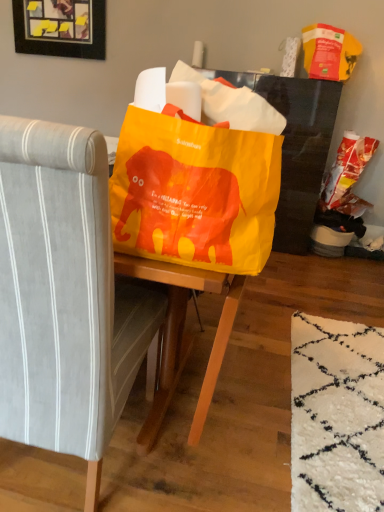
Question: Is wooden frame with yellow sticky notes at upper left in front of yellow plastic grocery bag at upper right, acting as the 2th grocery bag starting from the bottom?

Choices:
 (A) no
 (B) yes

Answer: (A)

Question: Is wooden frame with yellow sticky notes at upper left positioned beyond the bounds of yellow plastic grocery bag at upper right, arranged as the first grocery bag when viewed from the top?

Choices:
 (A) yes
 (B) no

Answer: (A)

Question: Considering the relative sizes of wooden frame with yellow sticky notes at upper left and yellow plastic grocery bag at upper right, arranged as the first grocery bag when viewed from the top, in the image provided, is wooden frame with yellow sticky notes at upper left shorter than yellow plastic grocery bag at upper right, arranged as the first grocery bag when viewed from the top,?

Choices:
 (A) yes
 (B) no

Answer: (B)

Question: Is wooden frame with yellow sticky notes at upper left wider than yellow plastic grocery bag at upper right, arranged as the first grocery bag when viewed from the top?

Choices:
 (A) yes
 (B) no

Answer: (B)

Question: From the image's perspective, is wooden frame with yellow sticky notes at upper left under yellow plastic grocery bag at upper right, acting as the 2th grocery bag starting from the bottom?

Choices:
 (A) yes
 (B) no

Answer: (B)

Question: Do you think yellow plastic grocery bag at upper right, acting as the 2th grocery bag starting from the bottom, is within matte plastic grocery bag at right, placed as the 2th grocery bag when sorted from top to bottom, or outside of it?

Choices:
 (A) outside
 (B) inside

Answer: (A)

Question: Is yellow plastic grocery bag at upper right, acting as the 2th grocery bag starting from the bottom, wider or thinner than matte plastic grocery bag at right, which is the first grocery bag in bottom-to-top order?

Choices:
 (A) wide
 (B) thin

Answer: (A)

Question: From the image's perspective, relative to matte plastic grocery bag at right, placed as the 2th grocery bag when sorted from top to bottom, is yellow plastic grocery bag at upper right, arranged as the first grocery bag when viewed from the top, above or below?

Choices:
 (A) below
 (B) above

Answer: (B)

Question: In the image, is yellow plastic grocery bag at upper right, acting as the 2th grocery bag starting from the bottom, on the left side or the right side of matte plastic grocery bag at right, placed as the 2th grocery bag when sorted from top to bottom?

Choices:
 (A) right
 (B) left

Answer: (B)

Question: Is point (105, 437) closer or farther from the camera than point (347, 157)?

Choices:
 (A) farther
 (B) closer

Answer: (B)

Question: Do you think gray fabric chair at center is within matte plastic grocery bag at right, placed as the 2th grocery bag when sorted from top to bottom, or outside of it?

Choices:
 (A) inside
 (B) outside

Answer: (B)

Question: Considering the positions of gray fabric chair at center and matte plastic grocery bag at right, which is the first grocery bag in bottom-to-top order, in the image, is gray fabric chair at center bigger or smaller than matte plastic grocery bag at right, which is the first grocery bag in bottom-to-top order,?

Choices:
 (A) small
 (B) big

Answer: (B)

Question: From a real-world perspective, is gray fabric chair at center physically located above or below matte plastic grocery bag at right, which is the first grocery bag in bottom-to-top order?

Choices:
 (A) above
 (B) below

Answer: (B)

Question: In terms of size, does yellow plastic grocery bag at upper right, arranged as the first grocery bag when viewed from the top, appear bigger or smaller than gray fabric chair at center?

Choices:
 (A) big
 (B) small

Answer: (B)

Question: Which is correct: yellow plastic grocery bag at upper right, arranged as the first grocery bag when viewed from the top, is inside gray fabric chair at center, or outside of it?

Choices:
 (A) outside
 (B) inside

Answer: (A)